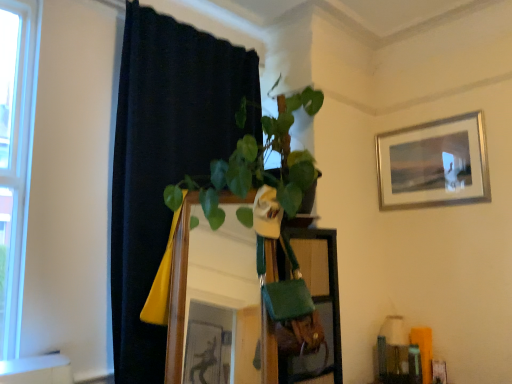
Question: Is the position of wooden mirror at center less distant than that of black fabric curtain at left?

Choices:
 (A) no
 (B) yes

Answer: (B)

Question: Considering the relative positions of wooden mirror at center and black fabric curtain at left in the image provided, is wooden mirror at center to the right of black fabric curtain at left from the viewer's perspective?

Choices:
 (A) yes
 (B) no

Answer: (A)

Question: Can you confirm if wooden mirror at center is shorter than black fabric curtain at left?

Choices:
 (A) no
 (B) yes

Answer: (B)

Question: Is wooden mirror at center far from black fabric curtain at left?

Choices:
 (A) yes
 (B) no

Answer: (B)

Question: From the image's perspective, is wooden mirror at center located beneath black fabric curtain at left?

Choices:
 (A) no
 (B) yes

Answer: (B)

Question: Does wooden mirror at center have a smaller size compared to black fabric curtain at left?

Choices:
 (A) no
 (B) yes

Answer: (B)

Question: Can you confirm if green fabric bag at center is taller than silver metallic picture frame at upper right?

Choices:
 (A) yes
 (B) no

Answer: (A)

Question: Can you confirm if green fabric bag at center is positioned to the right of silver metallic picture frame at upper right?

Choices:
 (A) yes
 (B) no

Answer: (B)

Question: Is green fabric bag at center smaller than silver metallic picture frame at upper right?

Choices:
 (A) no
 (B) yes

Answer: (A)

Question: Is green fabric bag at center beside silver metallic picture frame at upper right?

Choices:
 (A) yes
 (B) no

Answer: (B)

Question: Is green fabric bag at center wider than silver metallic picture frame at upper right?

Choices:
 (A) yes
 (B) no

Answer: (A)

Question: From the image's perspective, is green fabric bag at center located above silver metallic picture frame at upper right?

Choices:
 (A) no
 (B) yes

Answer: (A)

Question: Can you confirm if silver metallic picture frame at upper right is thinner than green fabric bag at center?

Choices:
 (A) yes
 (B) no

Answer: (A)